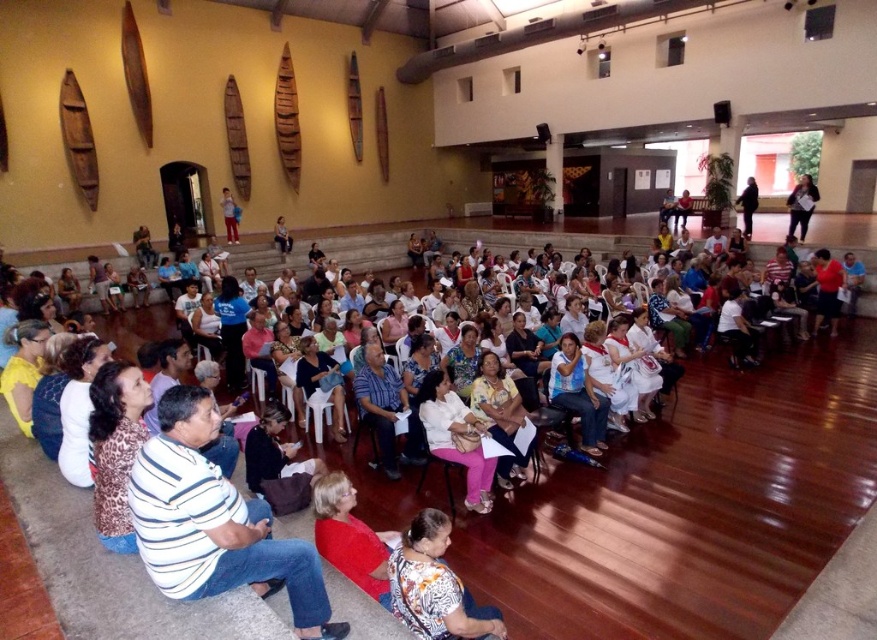
You are standing at the entrance of the community hall and notice a white fabric dress at center. Where exactly is the white fabric dress located in relation to the entrance?

The white fabric dress at center is located at point 0.684 along the horizontal axis and 0.521 along the vertical axis relative to the entrance.

You are an attendee at the event and you want to find the person wearing the white fabric dress at center and the floral print blouse at center. Which clothing item is closer to the ground?

The white fabric dress at center is located below the floral print blouse at center, so the white fabric dress at center is closer to the ground.

You are an event planner standing at the back of the hall. You need to locate the two attendees wearing the white fabric dress at center and the striped shirt at center. Which one is closer to the stage?

The white fabric dress at center is closer to the stage because it is located below the striped shirt at center, meaning it is positioned lower in the image which corresponds to being nearer to the stage area.